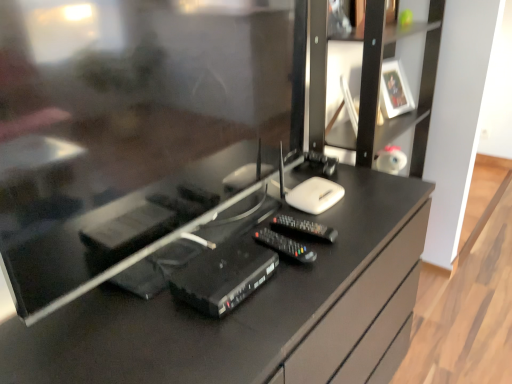
The height and width of the screenshot is (384, 512). What do you see at coordinates (394, 90) in the screenshot?
I see `white glossy picture frame at upper right` at bounding box center [394, 90].

You are a GUI agent. You are given a task and a screenshot of the screen. Output one action in this format:
    pyautogui.click(x=<x>, y=<y>)
    Task: Click on the black plastic router at center, placed as the 2th equipment when sorted from right to left
    
    Given the screenshot: What is the action you would take?
    pyautogui.click(x=223, y=276)

The height and width of the screenshot is (384, 512). What do you see at coordinates (223, 276) in the screenshot? I see `black plastic router at center, placed as the first equipment when sorted from left to right` at bounding box center [223, 276].

Image resolution: width=512 pixels, height=384 pixels. I want to click on black matte tv cabinet at right, so [x=413, y=84].

In order to face black matte tv cabinet at right, should I rotate leftwards or rightwards?

Turn right approximately 15.947 degrees to face it.

What do you see at coordinates (306, 227) in the screenshot? I see `black plastic remote at center` at bounding box center [306, 227].

I want to click on black plastic remote control at center, acting as the 1th equipment starting from the right, so click(284, 245).

The image size is (512, 384). Identify the location of white glossy picture frame at upper right. (394, 90).

Would you say black plastic remote at center is part of black glossy desk at center's contents?

That's correct, black plastic remote at center is inside black glossy desk at center.

Considering the relative sizes of black glossy desk at center and black plastic remote at center in the image provided, is black glossy desk at center bigger than black plastic remote at center?

Yes.

From a real-world perspective, who is located lower, black glossy desk at center or black plastic remote at center?

In real-world perspective, black glossy desk at center is lower.

From the picture: Between black plastic remote at center and black matte tv cabinet at right, which one appears on the right side from the viewer's perspective?

From the viewer's perspective, black matte tv cabinet at right appears more on the right side.

Between black plastic remote at center and black matte tv cabinet at right, which one has more height?

With more height is black matte tv cabinet at right.

Where is `tv cabinet located above the black plastic remote at center (from the image's perspective)`? The image size is (512, 384). tv cabinet located above the black plastic remote at center (from the image's perspective) is located at coordinates click(413, 84).

At what (x,y) coordinates should I click in order to perform the action: click on picture frame that is behind the black plastic router at center, placed as the first equipment when sorted from left to right. Please return your answer as a coordinate pair (x, y). Image resolution: width=512 pixels, height=384 pixels. Looking at the image, I should click on (394, 90).

From the image's perspective, is white glossy picture frame at upper right on black plastic router at center, placed as the 2th equipment when sorted from right to left?

Yes, from the image's perspective, white glossy picture frame at upper right is on top of black plastic router at center, placed as the 2th equipment when sorted from right to left.

Does white glossy picture frame at upper right appear on the left side of black plastic router at center, placed as the first equipment when sorted from left to right?

No.

Does point (403, 107) lie in front of point (283, 251)?

No, (403, 107) is further to viewer.

Between white glossy picture frame at upper right and black plastic remote control at center, the 2th equipment positioned from the left, which one is positioned behind?

white glossy picture frame at upper right is behind.

Who is bigger, white glossy picture frame at upper right or black plastic remote control at center, acting as the 1th equipment starting from the right?

white glossy picture frame at upper right is bigger.

Is white glossy picture frame at upper right inside the boundaries of black plastic remote control at center, acting as the 1th equipment starting from the right, or outside?

white glossy picture frame at upper right exists outside the volume of black plastic remote control at center, acting as the 1th equipment starting from the right.

From the picture: Considering the positions of objects black glossy desk at center and black plastic router at center, placed as the 2th equipment when sorted from right to left, in the image provided, who is more to the right, black glossy desk at center or black plastic router at center, placed as the 2th equipment when sorted from right to left,?

black glossy desk at center.

From a real-world perspective, is black glossy desk at center located beneath black plastic router at center, placed as the first equipment when sorted from left to right?

Yes, from a real-world perspective, black glossy desk at center is below black plastic router at center, placed as the first equipment when sorted from left to right.

Is black glossy desk at center facing away from black plastic router at center, placed as the first equipment when sorted from left to right?

No.

Find the location of a particular element. The height and width of the screenshot is (384, 512). the 1st equipment positioned below the black matte tv cabinet at right (from a real-world perspective) is located at coordinates (223, 276).

From the image's perspective, is black matte tv cabinet at right over black plastic router at center, placed as the first equipment when sorted from left to right?

Correct, black matte tv cabinet at right appears higher than black plastic router at center, placed as the first equipment when sorted from left to right, in the image.

Considering the relative positions of black matte tv cabinet at right and black plastic router at center, placed as the 2th equipment when sorted from right to left, in the image provided, is black matte tv cabinet at right to the left of black plastic router at center, placed as the 2th equipment when sorted from right to left, from the viewer's perspective?

No.

From a real-world perspective, which object stands above the other?

From a 3D spatial view, black matte tv cabinet at right is above.

In terms of width, does black plastic router at center, placed as the 2th equipment when sorted from right to left, look wider or thinner when compared to black matte tv cabinet at right?

In the image, black plastic router at center, placed as the 2th equipment when sorted from right to left, appears to be more narrow than black matte tv cabinet at right.

Considering the relative positions of black plastic router at center, placed as the first equipment when sorted from left to right, and black matte tv cabinet at right in the image provided, is black plastic router at center, placed as the first equipment when sorted from left to right, to the left of black matte tv cabinet at right from the viewer's perspective?

Yes, black plastic router at center, placed as the first equipment when sorted from left to right, is to the left of black matte tv cabinet at right.

From a real-world perspective, which is physically below, black plastic router at center, placed as the first equipment when sorted from left to right, or black matte tv cabinet at right?

In real-world perspective, black plastic router at center, placed as the first equipment when sorted from left to right, is lower.

Between black plastic router at center, placed as the first equipment when sorted from left to right, and black matte tv cabinet at right, which one has more height?

With more height is black matte tv cabinet at right.

Identify the location of desk below the black plastic remote at center (from a real-world perspective). The image size is (512, 384). (240, 308).

In order to click on control below the black matte tv cabinet at right (from the image's perspective) in this screenshot , I will do 306,227.

Considering their positions, is black plastic router at center, placed as the 2th equipment when sorted from right to left, positioned closer to white glossy picture frame at upper right than black plastic remote at center?

black plastic remote at center is positioned closer to the anchor white glossy picture frame at upper right.

Which object lies nearer to the anchor point black matte tv cabinet at right, black glossy desk at center or black plastic remote at center?

black glossy desk at center is positioned closer to the anchor black matte tv cabinet at right.

Which object lies further to the anchor point black plastic remote at center, black matte tv cabinet at right or white glossy picture frame at upper right?

white glossy picture frame at upper right.

Estimate the real-world distances between objects in this image. Which object is further from black plastic router at center, placed as the 2th equipment when sorted from right to left, black plastic remote at center or white glossy picture frame at upper right?

The object further to black plastic router at center, placed as the 2th equipment when sorted from right to left, is white glossy picture frame at upper right.

From the image, which object appears to be nearer to black glossy desk at center, white glossy picture frame at upper right or black plastic remote control at center, acting as the 1th equipment starting from the right?

Based on the image, black plastic remote control at center, acting as the 1th equipment starting from the right, appears to be nearer to black glossy desk at center.

When comparing their distances from black plastic remote control at center, acting as the 1th equipment starting from the right, does black matte tv cabinet at right or black plastic router at center, placed as the first equipment when sorted from left to right, seem closer?

Among the two, black plastic router at center, placed as the first equipment when sorted from left to right, is located nearer to black plastic remote control at center, acting as the 1th equipment starting from the right.

Looking at the image, which one is located closer to black matte tv cabinet at right, black plastic remote at center or white glossy picture frame at upper right?

Among the two, white glossy picture frame at upper right is located nearer to black matte tv cabinet at right.

Looking at the image, which one is located further to black matte tv cabinet at right, black glossy desk at center or black plastic remote control at center, acting as the 1th equipment starting from the right?

Among the two, black plastic remote control at center, acting as the 1th equipment starting from the right, is located further to black matte tv cabinet at right.

Find the location of a particular element. equipment located between black plastic router at center, placed as the first equipment when sorted from left to right, and white glossy picture frame at upper right in the depth direction is located at coordinates (284, 245).

The height and width of the screenshot is (384, 512). Identify the location of control situated between black plastic router at center, placed as the 2th equipment when sorted from right to left, and black matte tv cabinet at right from left to right. pos(306,227).

Image resolution: width=512 pixels, height=384 pixels. I want to click on tv cabinet between black plastic remote at center and white glossy picture frame at upper right along the z-axis, so click(x=413, y=84).

Locate an element on the screen. equipment located between black plastic router at center, placed as the first equipment when sorted from left to right, and black matte tv cabinet at right in the left-right direction is located at coordinates (x=284, y=245).